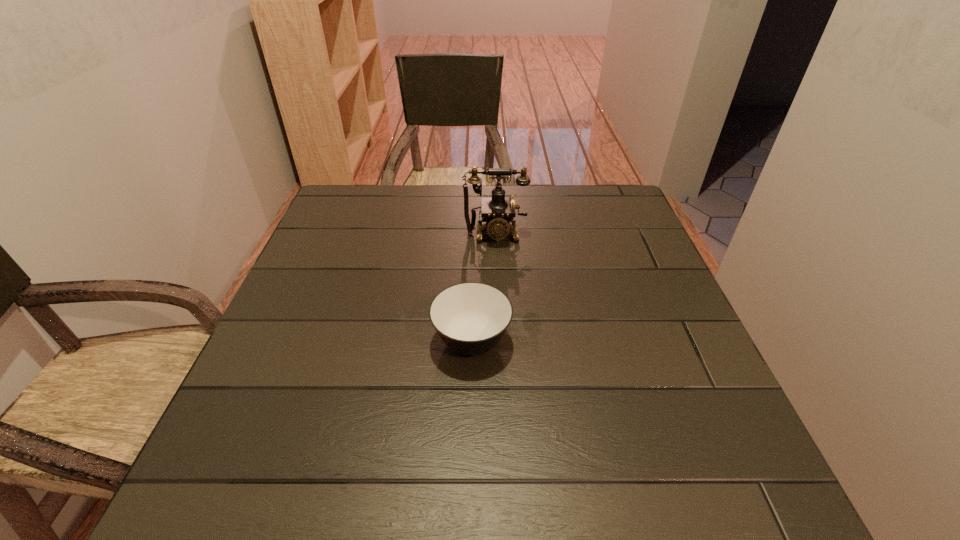
At what (x,y) coordinates should I click in order to perform the action: click on the taller object. Please return your answer as a coordinate pair (x, y). The image size is (960, 540). Looking at the image, I should click on (498, 211).

Identify the location of telephone. The image size is (960, 540). (498, 211).

This screenshot has height=540, width=960. What are the coordinates of `the nearer object` in the screenshot? It's located at (470, 318).

Identify the location of soup bowl. (470, 318).

The height and width of the screenshot is (540, 960). What are the coordinates of `free spot located on the rotary dial of the taller object` in the screenshot? It's located at (500, 348).

The image size is (960, 540). What are the coordinates of `free region located on the front of the shorter object` in the screenshot? It's located at (469, 445).

This screenshot has height=540, width=960. Find the location of `object that is at the far edge`. object that is at the far edge is located at coordinates pyautogui.click(x=498, y=211).

In the image, there is a desktop. Where is `vacant area at the far edge`? vacant area at the far edge is located at coordinates (443, 205).

In the image, there is a desktop. At what (x,y) coordinates should I click in order to perform the action: click on blank space at the near edge. Please return your answer as a coordinate pair (x, y). The width and height of the screenshot is (960, 540). Looking at the image, I should click on (391, 505).

Locate an element on the screen. This screenshot has height=540, width=960. free region at the right edge is located at coordinates (601, 280).